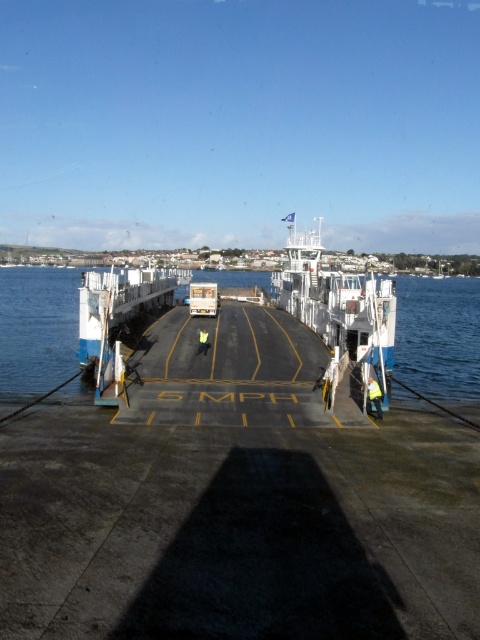
You are standing on the pier and want to take a photo of the ferry. Where should you aim your camera to capture the blue water at center in the image?

The blue water at center is located at the 2D coordinates point (439,336) in the image, so you should aim your camera towards that point to capture it.

You are standing on the pier and see the ferry with a truck in the center. There is a point marked at coordinates (373, 396). What object is located at that point?

The point at coordinates (373, 396) indicates a yellow reflective vest at lower right.